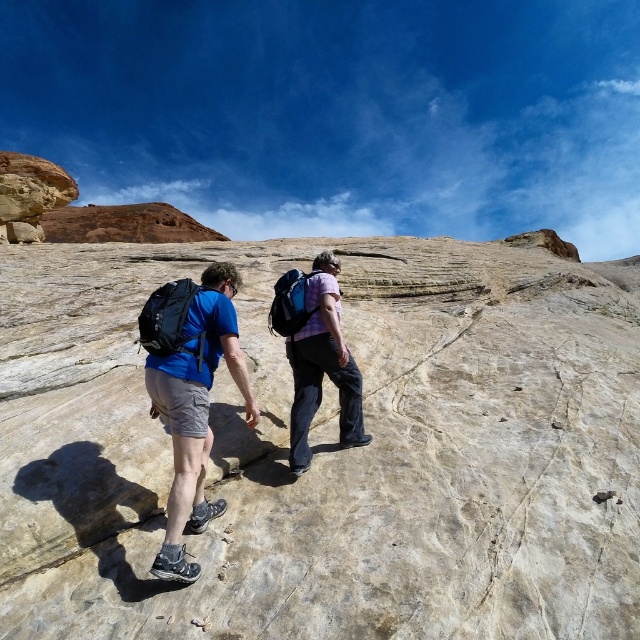
Does matte blue shirt at center appear over plaid shirt at center?

No, matte blue shirt at center is not above plaid shirt at center.

Which is in front, point (211, 340) or point (310, 337)?

Positioned in front is point (211, 340).

The width and height of the screenshot is (640, 640). I want to click on matte blue shirt at center, so click(x=189, y=394).

Does matte black backpack at center have a larger size compared to plaid shirt at center?

Correct, matte black backpack at center is larger in size than plaid shirt at center.

Is matte black backpack at center positioned in front of plaid shirt at center?

Yes, it is in front of plaid shirt at center.

Which is behind, point (180, 404) or point (278, 288)?

The point (278, 288) is more distant.

Locate an element on the screen. The image size is (640, 640). matte black backpack at center is located at coordinates (x=195, y=408).

Does matte blue shirt at center appear under matte black backpack at center?

No.

Is matte blue shirt at center thinner than matte black backpack at center?

Yes.

Is point (177, 573) closer to camera compared to point (227, 360)?

Yes, point (177, 573) is closer to viewer.

Identify the location of matte blue shirt at center. (189, 394).